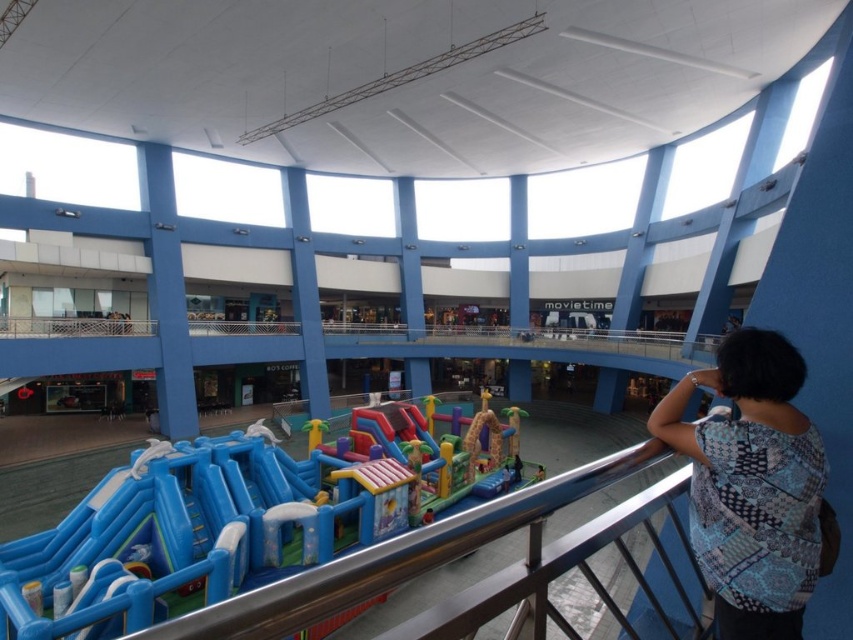
Question: Which point is farther from the camera taking this photo?

Choices:
 (A) (15, 614)
 (B) (791, 374)

Answer: (A)

Question: Which of the following is the farthest from the observer?

Choices:
 (A) (149, 488)
 (B) (769, 410)

Answer: (A)

Question: Can you confirm if blue inflatable obstacle course at center is positioned below blue printed blouse at upper right?

Choices:
 (A) no
 (B) yes

Answer: (B)

Question: Is blue inflatable obstacle course at center to the right of blue printed blouse at upper right from the viewer's perspective?

Choices:
 (A) yes
 (B) no

Answer: (B)

Question: Is blue inflatable obstacle course at center positioned in front of blue printed blouse at upper right?

Choices:
 (A) no
 (B) yes

Answer: (A)